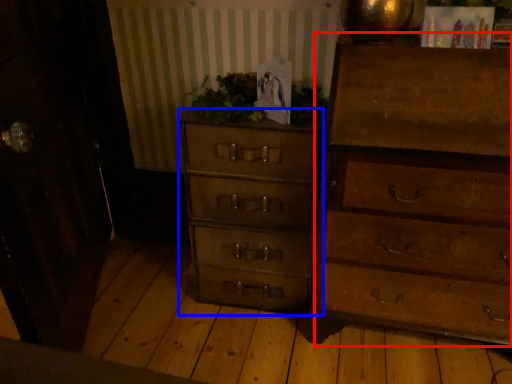
Question: Among these objects, which one is farthest to the camera, chest of drawers (highlighted by a red box) or chest of drawers (highlighted by a blue box)?

Choices:
 (A) chest of drawers
 (B) chest of drawers

Answer: (B)